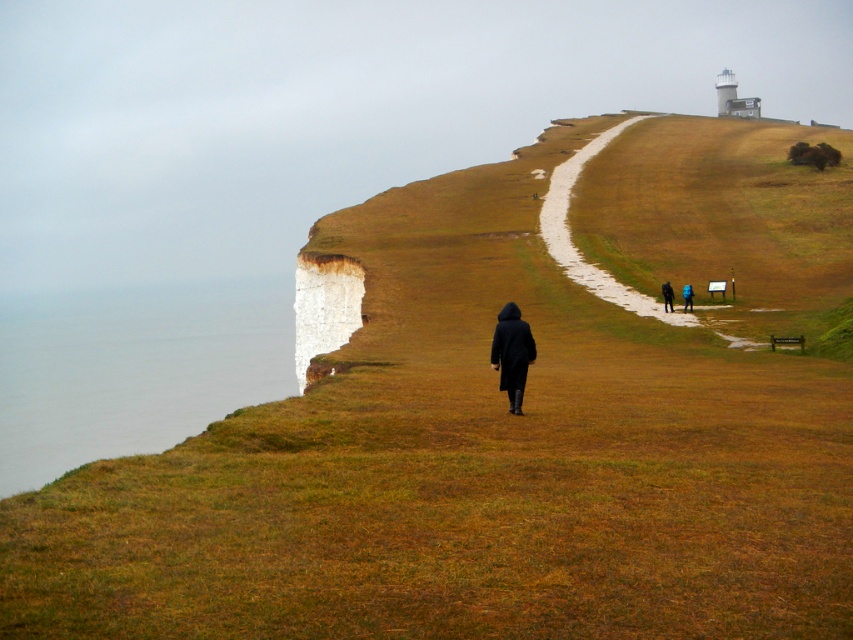
In the scene shown: Is dark blue coat at center-right thinner than dark blue jacket at center?

Indeed, dark blue coat at center-right has a lesser width compared to dark blue jacket at center.

Does dark blue coat at center-right have a smaller size compared to dark blue jacket at center?

Yes.

Measure the distance between dark blue coat at center-right and camera.

dark blue coat at center-right and camera are 202.34 feet apart from each other.

The width and height of the screenshot is (853, 640). Identify the location of dark blue coat at center-right. (666, 296).

Consider the image. Which of these two, brown grassy hillside at center or dark blue jacket at center, stands taller?

Standing taller between the two is brown grassy hillside at center.

Is point (683, 314) positioned before point (689, 289)?

Yes, point (683, 314) is in front of point (689, 289).

Identify the location of brown grassy hillside at center. [323, 307].

Who is positioned more to the left, gravel pathway at upper right or matte black coat at center?

matte black coat at center is more to the left.

Is gravel pathway at upper right below matte black coat at center?

No, gravel pathway at upper right is not below matte black coat at center.

Does point (561, 184) lie behind point (514, 323)?

Yes, it is.

Where is `gravel pathway at upper right`? gravel pathway at upper right is located at coordinates (577, 248).